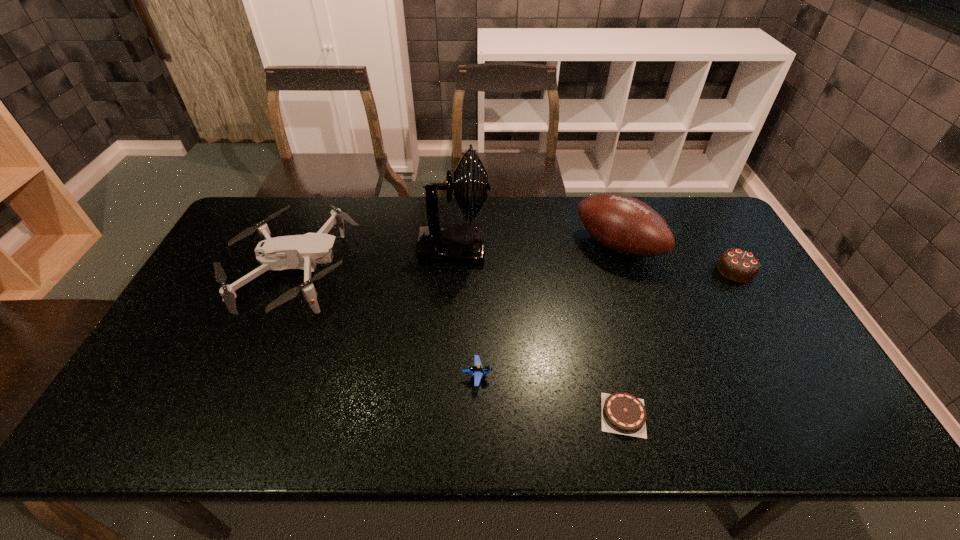
Locate an element on the screen. Image resolution: width=960 pixels, height=540 pixels. free space located 0.070m in front of the fan to blow air is located at coordinates (511, 246).

You are a GUI agent. You are given a task and a screenshot of the screen. Output one action in this format:
    pyautogui.click(x=<x>, y=<y>)
    Task: Click on the vacant position located 0.090m on the right of the second tallest object
    
    Given the screenshot: What is the action you would take?
    pyautogui.click(x=685, y=246)

Image resolution: width=960 pixels, height=540 pixels. I want to click on blank area located with a camera at the front of the drone, so click(x=492, y=273).

The image size is (960, 540). I want to click on vacant space located on the back of the fourth tallest object, so click(x=693, y=198).

Image resolution: width=960 pixels, height=540 pixels. What are the coordinates of `blank area located on the front-facing side of the fifth farthest object` in the screenshot? It's located at (520, 376).

Image resolution: width=960 pixels, height=540 pixels. I want to click on vacant space situated on the back of the nearest object, so click(600, 321).

I want to click on fan at the far edge, so click(461, 242).

Where is `football (American) that is positioned at the far edge`? football (American) that is positioned at the far edge is located at coordinates (623, 224).

Where is `drone present at the far edge`? The image size is (960, 540). drone present at the far edge is located at coordinates (303, 252).

Find the location of a particular element. object that is at the near edge is located at coordinates (622, 413).